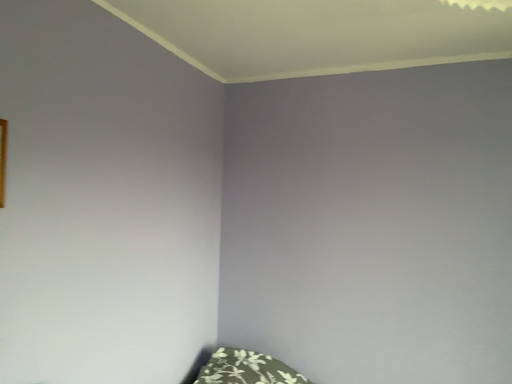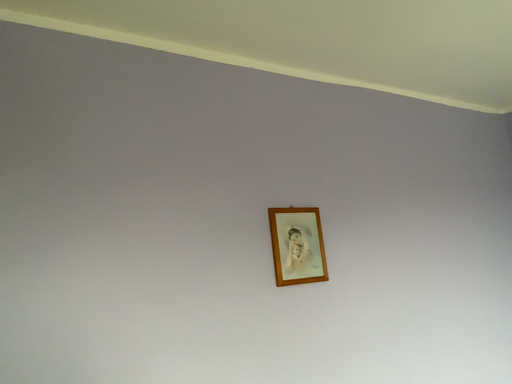
Question: How did the camera likely rotate when shooting the video?

Choices:
 (A) rotated right
 (B) rotated left

Answer: (B)